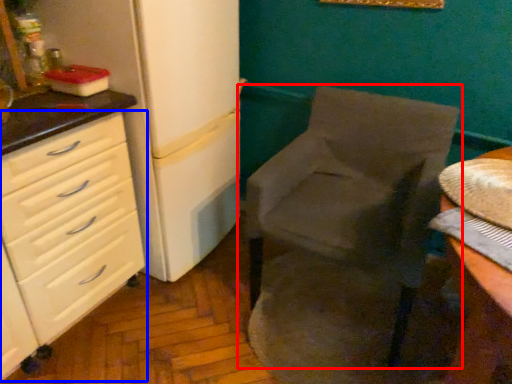
Question: Among these objects, which one is farthest to the camera, chair (highlighted by a red box) or chest of drawers (highlighted by a blue box)?

Choices:
 (A) chair
 (B) chest of drawers

Answer: (A)